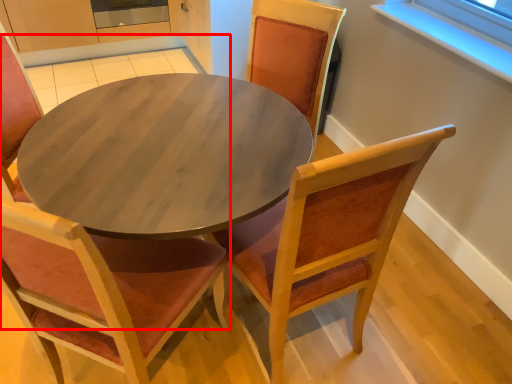
Question: Observing the image, what is the correct spatial positioning of chair (annotated by the red box) in reference to chair?

Choices:
 (A) left
 (B) right

Answer: (A)